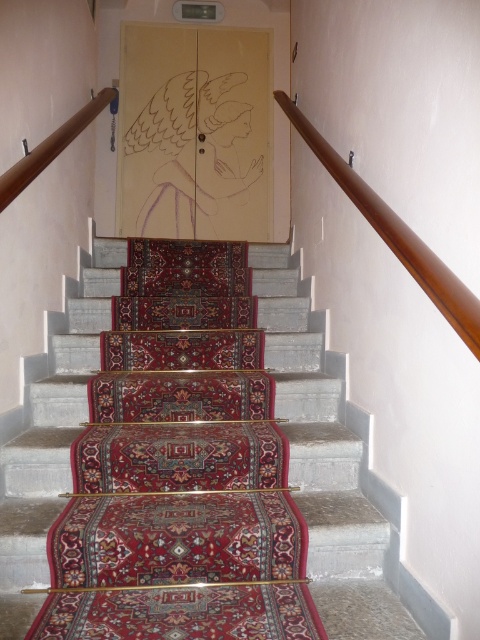
Which is more to the right, wooden handrail at upper right or brown wooden handrail at upper left?

wooden handrail at upper right

Measure the distance from wooden handrail at upper right to brown wooden handrail at upper left.

wooden handrail at upper right and brown wooden handrail at upper left are 33.84 inches apart from each other.

Is point (349, 186) farther from camera compared to point (108, 92)?

No.

This screenshot has height=640, width=480. I want to click on wooden handrail at upper right, so click(x=396, y=234).